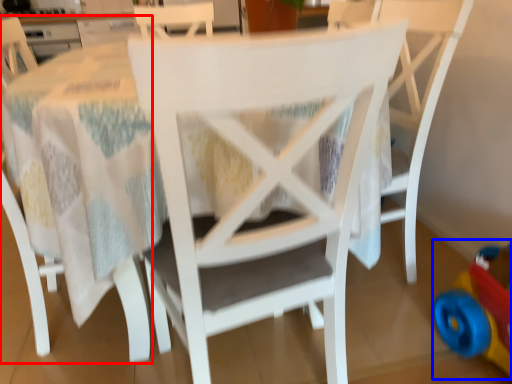
Question: Which object appears closest to the camera in this image, chair (highlighted by a red box) or toy (highlighted by a blue box)?

Choices:
 (A) chair
 (B) toy

Answer: (A)